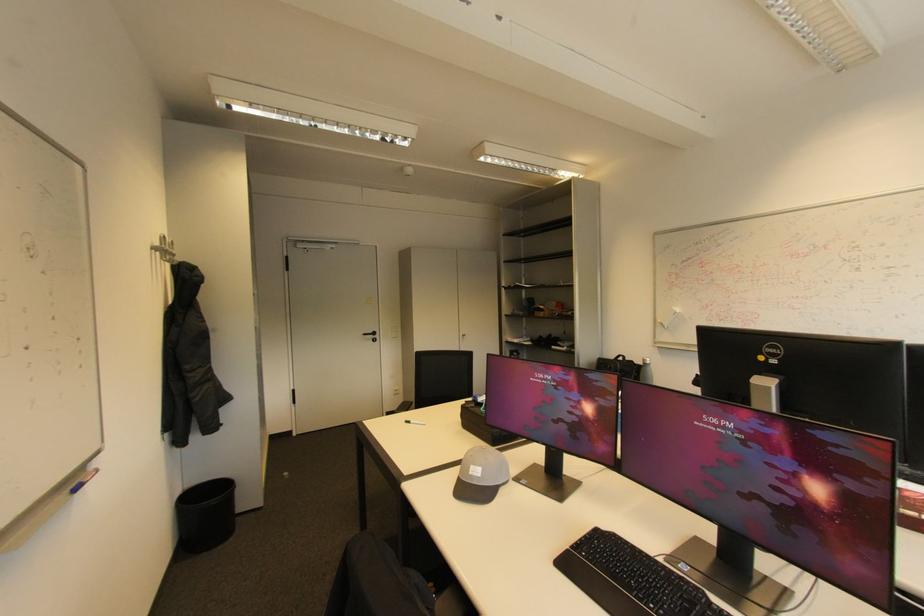
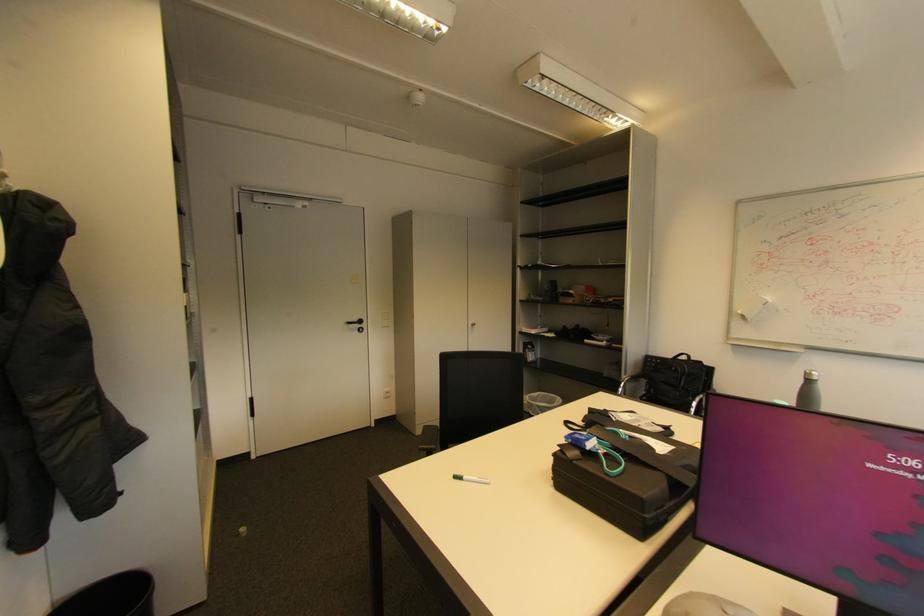
Locate, in the second image, the point that corresponds to pixel 380 334 in the first image.

(366, 322)